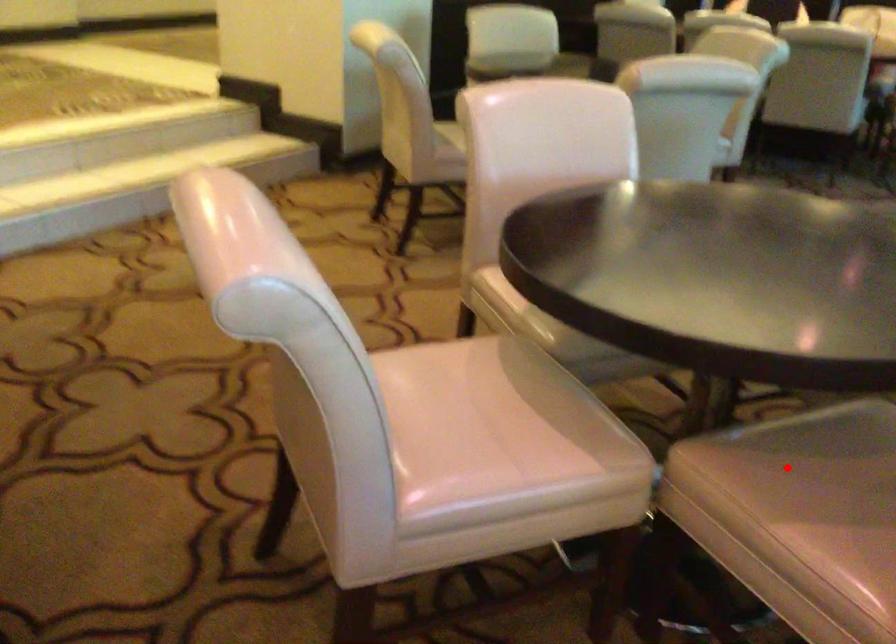
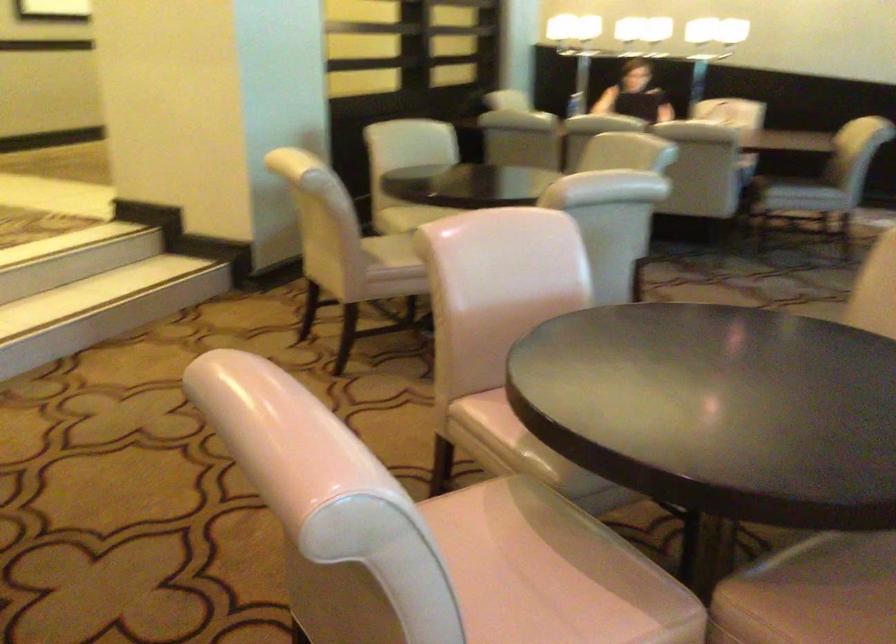
Find the pixel in the second image that matches the highlighted location in the first image.

(828, 590)